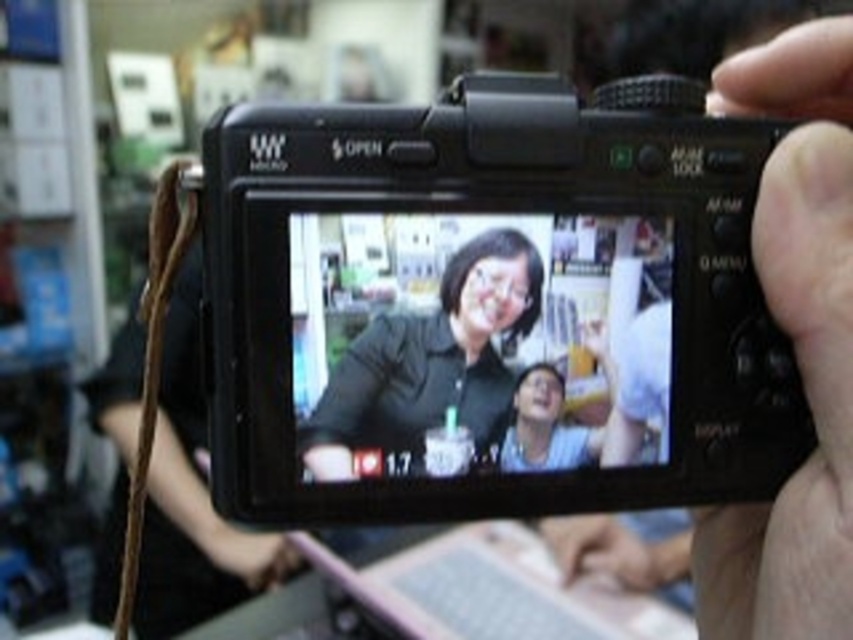
You are holding the black plastic camera at center and want to place it on a shelf that is 30 centimeters wide. Will the camera fit on the shelf?

The black plastic camera at center has a width of 33.05 centimeters, which is wider than the 30 centimeter shelf. Therefore, it will not fit on the shelf.

You are a photographer holding a black matte camera at right and a matte black shirt at center. You need to place a small sticker between them. Is there enough space to place the sticker without overlapping either object?

The distance between the black matte camera at right and the matte black shirt at center is 10.69 centimeters, so there is sufficient space to place the sticker between them without overlapping either object.